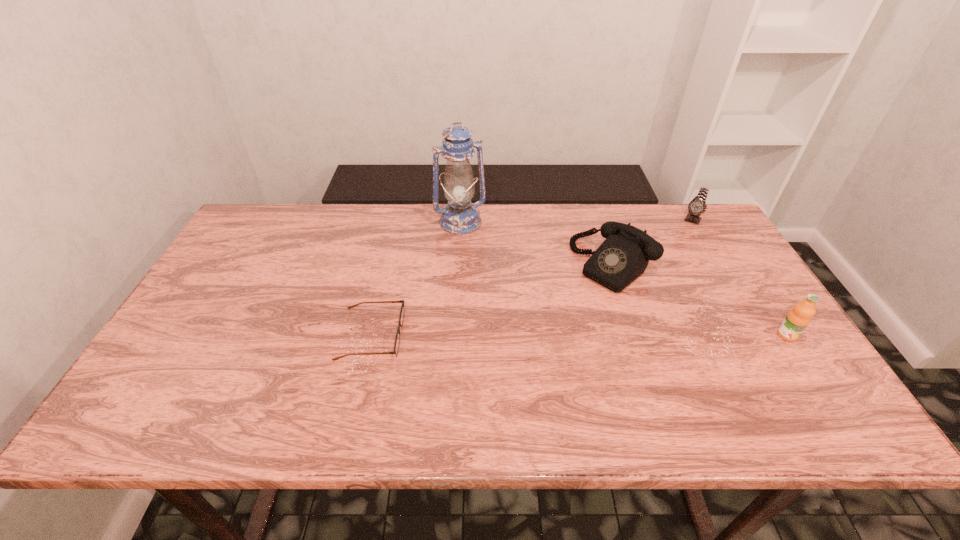
Where is `watch present at the far edge`? The height and width of the screenshot is (540, 960). watch present at the far edge is located at coordinates (697, 206).

At what (x,y) coordinates should I click in order to perform the action: click on object situated at the near edge. Please return your answer as a coordinate pair (x, y). The width and height of the screenshot is (960, 540). Looking at the image, I should click on (397, 340).

The image size is (960, 540). What are the coordinates of `orange juice that is at the right edge` in the screenshot? It's located at (798, 318).

Find the location of `watch that is at the right edge`. watch that is at the right edge is located at coordinates (697, 206).

What are the coordinates of `object located in the far right corner section of the desktop` in the screenshot? It's located at (697, 206).

You are a GUI agent. You are given a task and a screenshot of the screen. Output one action in this format:
    pyautogui.click(x=<x>, y=<y>)
    Task: Click on the free space at the far edge
    Image resolution: width=960 pixels, height=540 pixels.
    Given the screenshot: What is the action you would take?
    click(364, 207)

Locate an element on the screen. The image size is (960, 540). free space at the near edge is located at coordinates (732, 382).

You are a GUI agent. You are given a task and a screenshot of the screen. Output one action in this format:
    pyautogui.click(x=<x>, y=<y>)
    Task: Click on the free space at the left edge of the desktop
    Image resolution: width=960 pixels, height=540 pixels.
    Given the screenshot: What is the action you would take?
    pyautogui.click(x=211, y=286)

You are a GUI agent. You are given a task and a screenshot of the screen. Output one action in this format:
    pyautogui.click(x=<x>, y=<y>)
    Task: Click on the free spot at the right edge of the desktop
    The width and height of the screenshot is (960, 540).
    Given the screenshot: What is the action you would take?
    pyautogui.click(x=714, y=259)

Locate an element on the screen. The height and width of the screenshot is (540, 960). vacant region at the far left corner of the desktop is located at coordinates (291, 211).